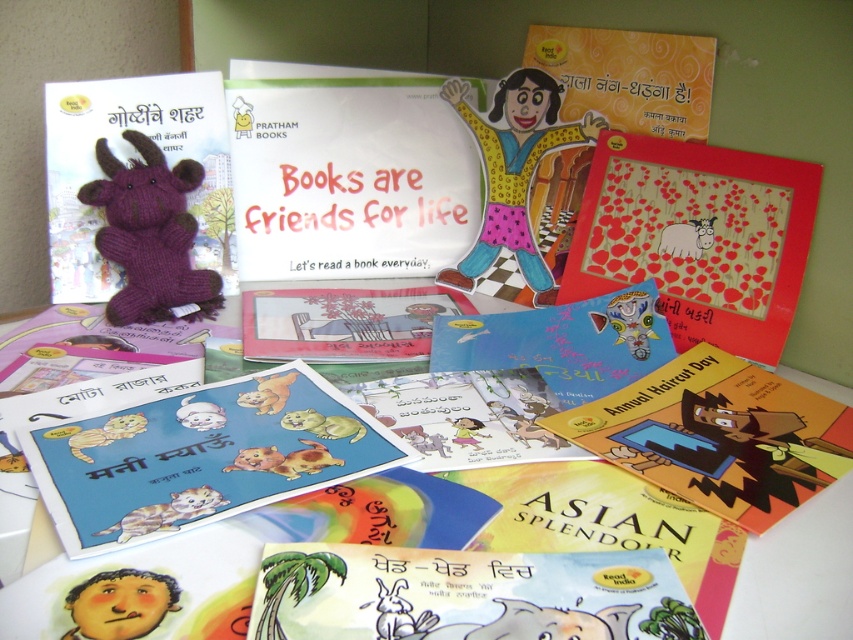
Based on the photo, you are organizing a childrens book fair and need to place the matte red frame at upper right and the yellow cardboard book at lower right on a shelf. Which object should be placed first to ensure proper visibility of both items?

The matte red frame at upper right should be placed first because it has a greater height than the yellow cardboard book at lower right, allowing it to be seen over the top of the book when placed behind or beside it.

You are organizing a childrens reading corner and need to place the matte red frame at upper right and the yellow cardboard book at lower right. According to the scene description, which object is placed above the other?

The matte red frame at upper right is positioned over yellow cardboard book at lower right, meaning it is placed above the yellow cardboard book at lower right.

You are organizing a childrens book fair and need to place the blue matte book at center and the matte yellow book at center on a shelf. If the shelf has limited space and you can only fit one of them, which book should you choose based on their size?

The blue matte book at center is larger in size than the matte yellow book at center, so you should choose the blue matte book at center to place on the shelf since it requires more space.